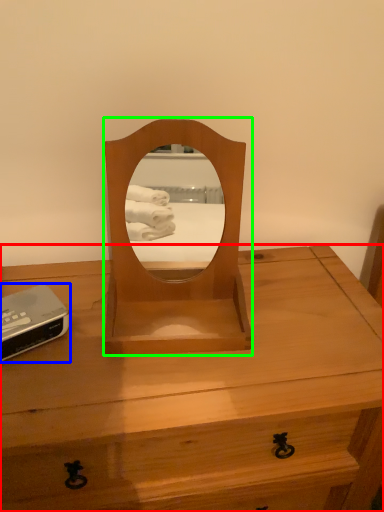
Question: Considering the real-world distances, which object is farthest from desk (highlighted by a red box)? gadget (highlighted by a blue box) or mirror (highlighted by a green box)?

Choices:
 (A) gadget
 (B) mirror

Answer: (A)